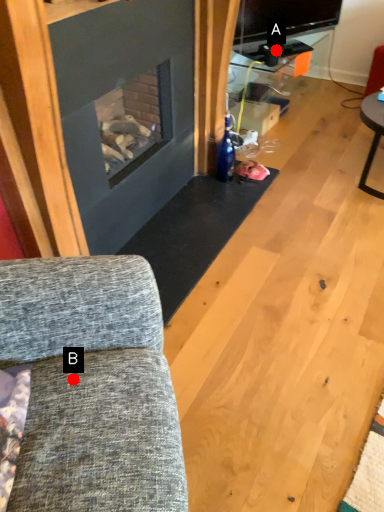
Question: Two points are circled on the image, labeled by A and B beside each circle. Which of the following is the closest to the observer?

Choices:
 (A) A is closer
 (B) B is closer

Answer: (B)